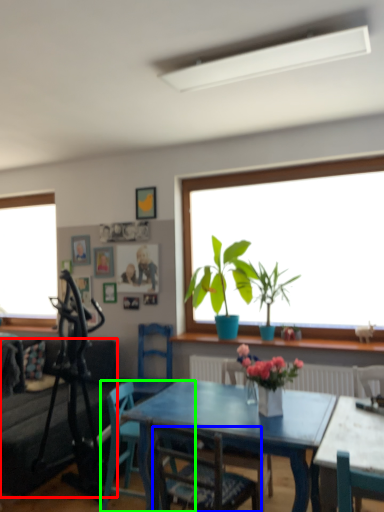
Question: Based on their relative distances, which object is nearer to studio couch (highlighted by a red box)? Choose from chair (highlighted by a blue box) and chair (highlighted by a green box).

Choices:
 (A) chair
 (B) chair

Answer: (B)